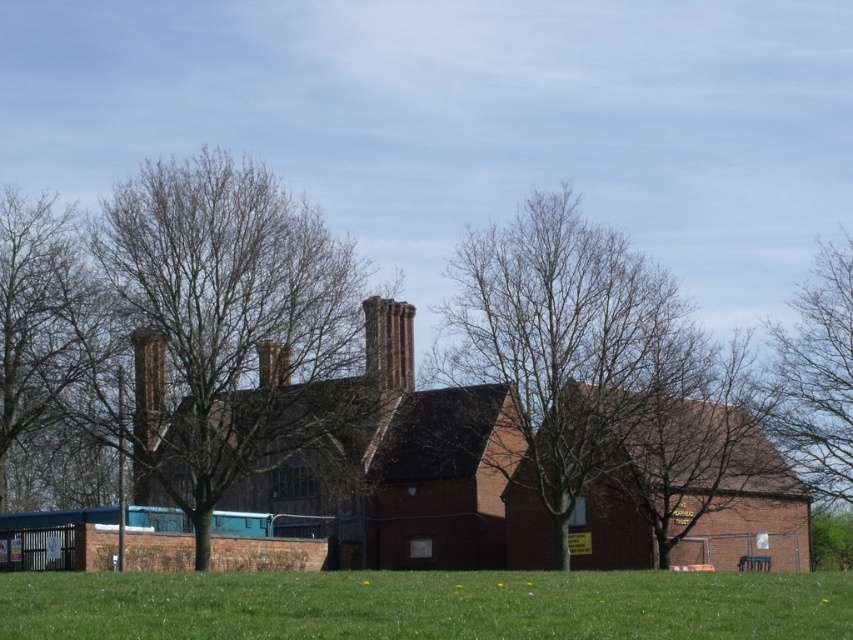
You are standing in front of the brick building and want to determine which of the two sets of bare branches you see are closer to you. The two sets are the bare branches at center and the bare branches at right. Based on their sizes, which one is closer?

The bare branches at center has a smaller size compared to bare branches at right, so the bare branches at center is closer to you because objects that are closer appear smaller in the image.